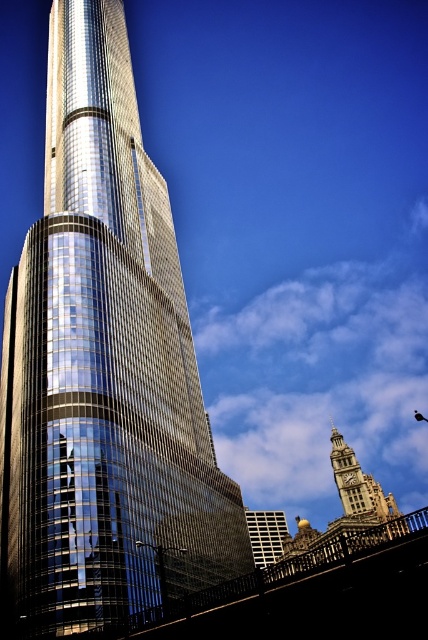
Is point (95, 260) farther from camera compared to point (262, 536)?

That is False.

In the scene shown: Does shiny glass skyscraper at left appear under matte glass building at lower center?

No.

You are a GUI agent. You are given a task and a screenshot of the screen. Output one action in this format:
    pyautogui.click(x=<x>, y=<y>)
    Task: Click on the shiny glass skyscraper at left
    
    Given the screenshot: What is the action you would take?
    (x=103, y=371)